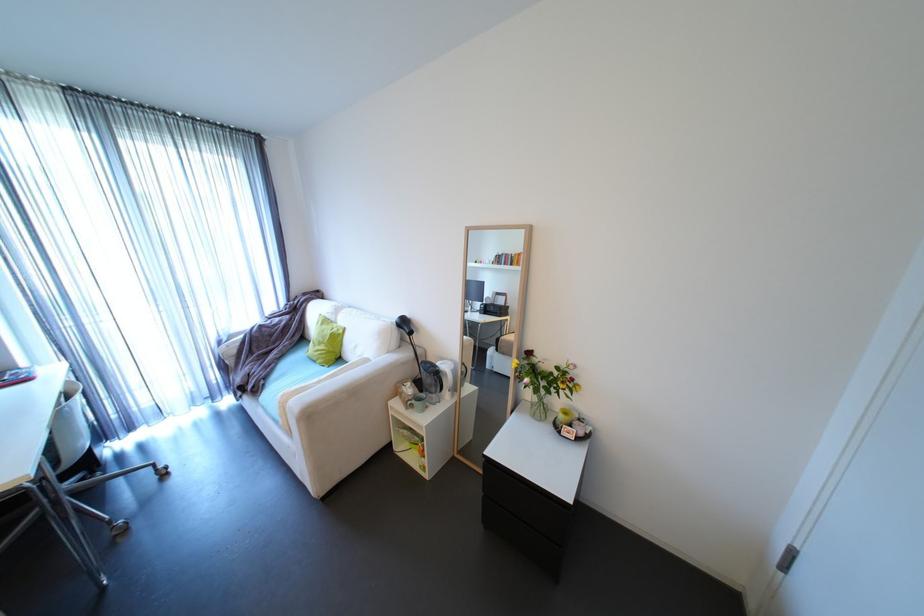
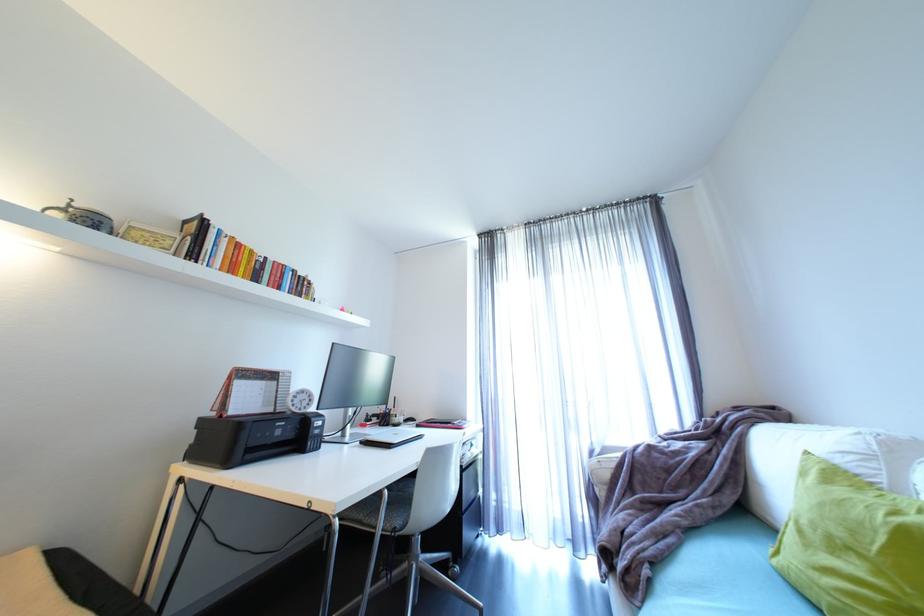
The point at (x=270, y=382) is marked in the first image. Where is the corresponding point in the second image?

(653, 572)